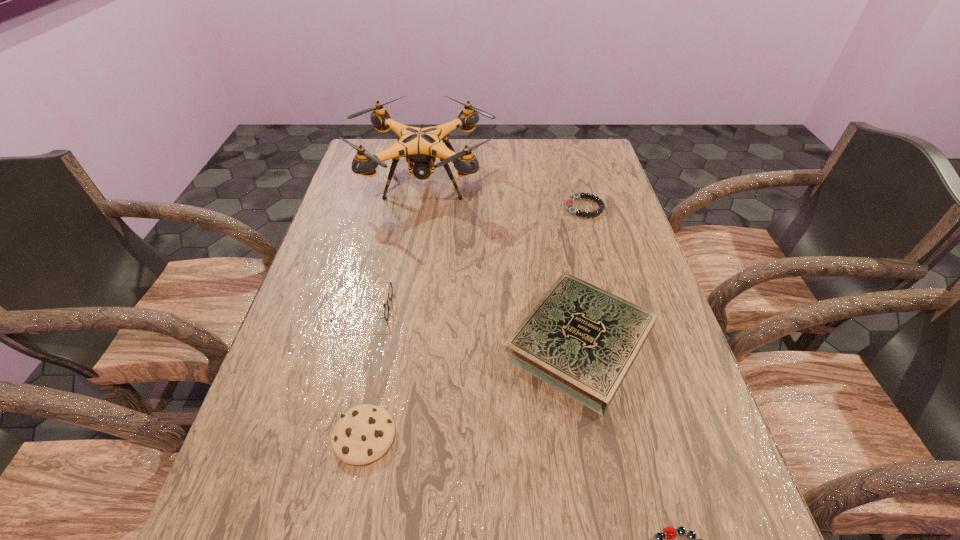
Identify the location of free space at the right edge. (718, 488).

I want to click on free spot at the far left corner of the desktop, so click(x=380, y=148).

Locate an element on the screen. vacant space at the far right corner of the desktop is located at coordinates (592, 153).

Locate an element on the screen. free point between the sunglasses and the cookie is located at coordinates (364, 372).

Image resolution: width=960 pixels, height=540 pixels. What are the coordinates of `free spot between the sunglasses and the tallest object` in the screenshot? It's located at (395, 245).

Image resolution: width=960 pixels, height=540 pixels. What are the coordinates of `free space between the cookie and the tallest object` in the screenshot? It's located at (395, 310).

You are a GUI agent. You are given a task and a screenshot of the screen. Output one action in this format:
    pyautogui.click(x=<x>, y=<y>)
    Task: Click on the free area in between the taller bracelet and the tallest object
    The width and height of the screenshot is (960, 540).
    Given the screenshot: What is the action you would take?
    pyautogui.click(x=505, y=195)

Find the location of a particular element. Image resolution: width=960 pixels, height=540 pixels. free spot between the hardback book and the tallest object is located at coordinates (502, 263).

The width and height of the screenshot is (960, 540). Find the location of `free space that is in between the cookie and the drone`. free space that is in between the cookie and the drone is located at coordinates (395, 310).

Identify the location of free space between the fifth tallest object and the sunglasses. The image size is (960, 540). (474, 257).